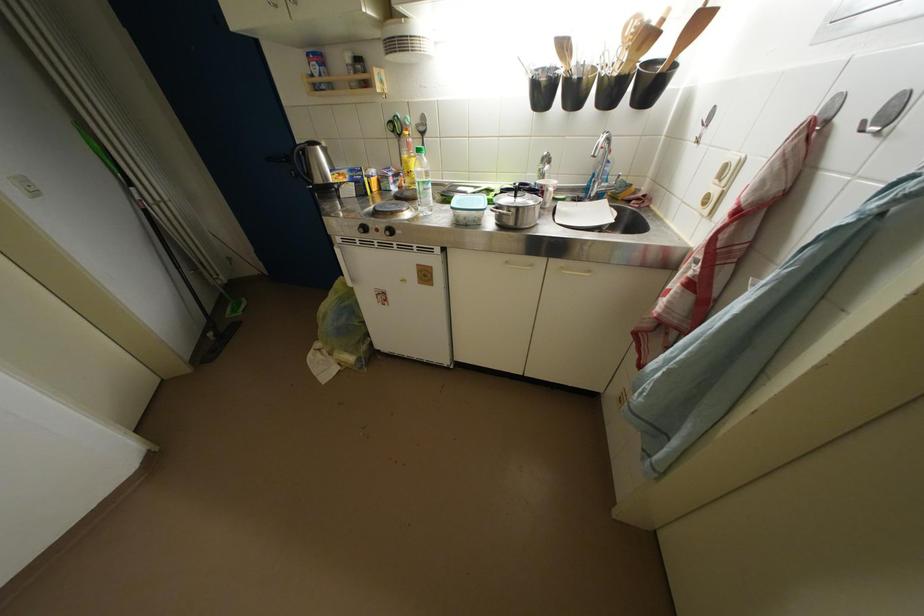
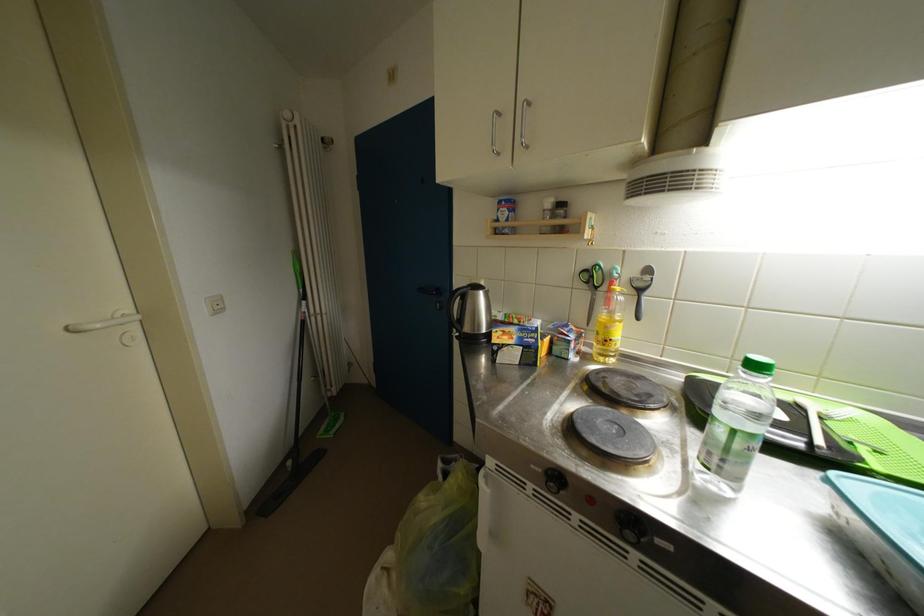
Consider the image. The first image is from the beginning of the video and the second image is from the end. How did the camera likely rotate when shooting the video?

The camera's rotation is toward left-up.